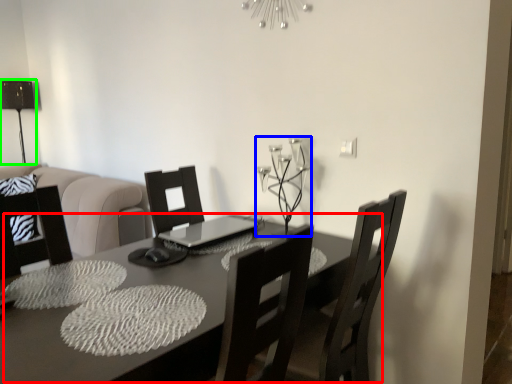
Question: Which is farther away from table (highlighted by a red box)? candle holder (highlighted by a blue box) or table lamp (highlighted by a green box)?

Choices:
 (A) candle holder
 (B) table lamp

Answer: (B)